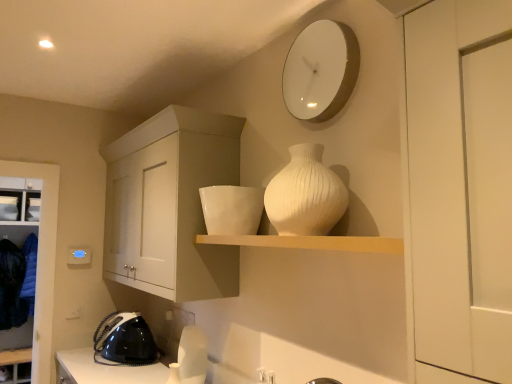
Locate an element on the screen. This screenshot has height=384, width=512. dark blue fabric at lower left is located at coordinates (13, 286).

What is the approximate height of dark blue fabric at lower left?

dark blue fabric at lower left is 91.99 centimeters tall.

What do you see at coordinates (305, 194) in the screenshot? I see `white ribbed vase at center` at bounding box center [305, 194].

Measure the distance between point (132, 320) and camera.

2.54 meters.

Where is `black plastic iron at lower left, which ranks as the second appliance in front-to-back order`? The width and height of the screenshot is (512, 384). black plastic iron at lower left, which ranks as the second appliance in front-to-back order is located at coordinates (125, 340).

Image resolution: width=512 pixels, height=384 pixels. Find the location of `metallic silver iron at left, marked as the 1th appliance in a back-to-front arrangement`. metallic silver iron at left, marked as the 1th appliance in a back-to-front arrangement is located at coordinates (9, 208).

Locate an element on the screen. white matte shelf at upper center is located at coordinates (310, 242).

From a real-world perspective, between white glossy bowl at upper center, which ranks as the 1th appliance in front-to-back order, and white glossy clock at upper center, who is vertically higher?

white glossy clock at upper center.

From the image's perspective, which is above, white glossy bowl at upper center, the 1th appliance from the top, or white glossy clock at upper center?

white glossy clock at upper center.

Can you confirm if white glossy bowl at upper center, which ranks as the 1th appliance in front-to-back order, is taller than white glossy clock at upper center?

In fact, white glossy bowl at upper center, which ranks as the 1th appliance in front-to-back order, may be shorter than white glossy clock at upper center.

Between white glossy bowl at upper center, acting as the third appliance starting from the back, and white glossy clock at upper center, which one has smaller width?

white glossy clock at upper center is thinner.

Considering the positions of objects black plastic iron at lower left, arranged as the second appliance when viewed from the left, and white matte cabinet at left, the second cabinetry in the front-to-back sequence, in the image provided, who is more to the left, black plastic iron at lower left, arranged as the second appliance when viewed from the left, or white matte cabinet at left, the second cabinetry in the front-to-back sequence,?

From the viewer's perspective, white matte cabinet at left, the second cabinetry in the front-to-back sequence, appears more on the left side.

Relative to white matte cabinet at left, arranged as the first cabinetry when viewed from the back, is black plastic iron at lower left, marked as the third appliance in a top-to-bottom arrangement, in front or behind?

Clearly, black plastic iron at lower left, marked as the third appliance in a top-to-bottom arrangement, is in front of white matte cabinet at left, arranged as the first cabinetry when viewed from the back.

Find the location of a particular element. This screenshot has width=512, height=384. appliance that appears below the white matte cabinet at left, which is counted as the 2th cabinetry, starting from the right (from a real-world perspective) is located at coordinates [x=125, y=340].

Is black plastic iron at lower left, acting as the 2th appliance starting from the right, oriented away from white matte shelf at upper center?

No, black plastic iron at lower left, acting as the 2th appliance starting from the right, is not facing away from white matte shelf at upper center.

Is black plastic iron at lower left, acting as the first appliance starting from the bottom, completely or partially outside of white matte shelf at upper center?

Yes, black plastic iron at lower left, acting as the first appliance starting from the bottom, is outside of white matte shelf at upper center.

In the image, is black plastic iron at lower left, acting as the first appliance starting from the bottom, positioned in front of or behind white matte shelf at upper center?

black plastic iron at lower left, acting as the first appliance starting from the bottom, is behind white matte shelf at upper center.

Considering the sizes of black plastic iron at lower left, acting as the first appliance starting from the bottom, and white matte shelf at upper center in the image, is black plastic iron at lower left, acting as the first appliance starting from the bottom, wider or thinner than white matte shelf at upper center?

black plastic iron at lower left, acting as the first appliance starting from the bottom, is wider than white matte shelf at upper center.

I want to click on shelf in front of the metallic silver iron at left, which is counted as the first appliance, starting from the left, so click(310, 242).

Considering the sizes of white matte shelf at upper center and metallic silver iron at left, which appears as the 2th appliance when viewed from the top, in the image, is white matte shelf at upper center wider or thinner than metallic silver iron at left, which appears as the 2th appliance when viewed from the top,?

white matte shelf at upper center is wider than metallic silver iron at left, which appears as the 2th appliance when viewed from the top.

From a real-world perspective, between white matte shelf at upper center and metallic silver iron at left, marked as the 1th appliance in a back-to-front arrangement, who is vertically lower?

From a 3D spatial view, white matte shelf at upper center is below.

Between point (203, 243) and point (12, 214), which one is positioned in front?

Positioned in front is point (203, 243).

Considering the sizes of objects white matte cabinet at left, arranged as the first cabinetry when viewed from the back, and black plastic iron at lower left, which ranks as the second appliance in front-to-back order, in the image provided, who is shorter, white matte cabinet at left, arranged as the first cabinetry when viewed from the back, or black plastic iron at lower left, which ranks as the second appliance in front-to-back order,?

Standing shorter between the two is black plastic iron at lower left, which ranks as the second appliance in front-to-back order.

From the image's perspective, count 1st appliances upward from the white matte cabinet at left, which is counted as the 1th cabinetry, starting from the left, and point to it. Please provide its 2D coordinates.

[(125, 340)]

Could you tell me if white matte cabinet at left, which is counted as the 2th cabinetry, starting from the right, is turned towards black plastic iron at lower left, arranged as the second appliance when viewed from the left?

No, white matte cabinet at left, which is counted as the 2th cabinetry, starting from the right, is not turned towards black plastic iron at lower left, arranged as the second appliance when viewed from the left.

Is white matte cabinet at left, arranged as the first cabinetry when viewed from the back, next to black plastic iron at lower left, arranged as the second appliance when viewed from the left?

No, white matte cabinet at left, arranged as the first cabinetry when viewed from the back, is not with black plastic iron at lower left, arranged as the second appliance when viewed from the left.

Based on the photo, is there a large distance between white glossy clock at upper center and white ribbed vase at center?

They are positioned close to each other.

Is white glossy clock at upper center outside of white ribbed vase at center?

Yes, white glossy clock at upper center is not within white ribbed vase at center.

From the image's perspective, is white glossy clock at upper center above or below white ribbed vase at center?

white glossy clock at upper center is situated higher than white ribbed vase at center in the image.

From a real-world perspective, is white matte cabinet at upper left, which is the 1th cabinetry from right to left, physically above white glossy bowl at upper center, the 1th appliance from the top?

Yes.

Are white matte cabinet at upper left, arranged as the second cabinetry when viewed from the back, and white glossy bowl at upper center, acting as the third appliance starting from the back, making contact?

No, white matte cabinet at upper left, arranged as the second cabinetry when viewed from the back, is not beside white glossy bowl at upper center, acting as the third appliance starting from the back.

At what (x,y) coordinates should I click in order to perform the action: click on appliance lying on the right of white matte cabinet at upper left, positioned as the first cabinetry in front-to-back order. Please return your answer as a coordinate pair (x, y). This screenshot has height=384, width=512. Looking at the image, I should click on (232, 209).

Where is `clock positioned vertically above the white glossy bowl at upper center, acting as the third appliance starting from the back (from a real-world perspective)`? clock positioned vertically above the white glossy bowl at upper center, acting as the third appliance starting from the back (from a real-world perspective) is located at coordinates (320, 71).

The image size is (512, 384). In order to click on cabinetry behind the black plastic iron at lower left, which is counted as the second appliance, starting from the back in this screenshot , I will do `click(42, 261)`.

Looking at the image, which one is located further to metallic silver iron at left, marked as the 1th appliance in a back-to-front arrangement, white glossy bowl at upper center, the 3th appliance in the bottom-to-top sequence, or white matte cabinet at upper left, positioned as the first cabinetry in front-to-back order?

Among the two, white glossy bowl at upper center, the 3th appliance in the bottom-to-top sequence, is located further to metallic silver iron at left, marked as the 1th appliance in a back-to-front arrangement.

Which object lies nearer to the anchor point dark blue fabric at lower left, white glossy clock at upper center or white ribbed vase at center?

white ribbed vase at center is closer to dark blue fabric at lower left.

From the image, which object appears to be nearer to white matte cabinet at left, which is counted as the 1th cabinetry, starting from the left, white glossy bowl at upper center, which ranks as the 1th appliance in front-to-back order, or white matte shelf at upper center?

Among the two, white glossy bowl at upper center, which ranks as the 1th appliance in front-to-back order, is located nearer to white matte cabinet at left, which is counted as the 1th cabinetry, starting from the left.

Which object lies further to the anchor point white glossy clock at upper center, white matte cabinet at left, arranged as the first cabinetry when viewed from the back, or white matte cabinet at upper left, positioned as the first cabinetry in front-to-back order?

Among the two, white matte cabinet at left, arranged as the first cabinetry when viewed from the back, is located further to white glossy clock at upper center.

When comparing their distances from black plastic iron at lower left, which is counted as the second appliance, starting from the back, does white matte cabinet at upper left, which is counted as the 2th cabinetry, starting from the left, or white glossy bowl at upper center, which is the 3th appliance in left-to-right order, seem closer?

Among the two, white matte cabinet at upper left, which is counted as the 2th cabinetry, starting from the left, is located nearer to black plastic iron at lower left, which is counted as the second appliance, starting from the back.

Looking at the image, which one is located further to white glossy clock at upper center, metallic silver iron at left, which appears as the 2th appliance when viewed from the top, or dark blue fabric at lower left?

The object further to white glossy clock at upper center is dark blue fabric at lower left.

From the image, which object appears to be nearer to white matte shelf at upper center, dark blue fabric at lower left or black plastic iron at lower left, acting as the first appliance starting from the bottom?

black plastic iron at lower left, acting as the first appliance starting from the bottom, lies closer to white matte shelf at upper center than the other object.

Which object lies further to the anchor point white matte shelf at upper center, white matte cabinet at left, which is counted as the 2th cabinetry, starting from the right, or black plastic iron at lower left, marked as the third appliance in a top-to-bottom arrangement?

Among the two, white matte cabinet at left, which is counted as the 2th cabinetry, starting from the right, is located further to white matte shelf at upper center.

Locate an element on the screen. The image size is (512, 384). appliance between white glossy bowl at upper center, the 3th appliance in the bottom-to-top sequence, and metallic silver iron at left, arranged as the 2th appliance when ordered from the bottom, along the z-axis is located at coordinates (125, 340).

Where is `vase situated between white matte cabinet at upper left, which is counted as the 2th cabinetry, starting from the left, and white glossy clock at upper center from left to right`? The image size is (512, 384). vase situated between white matte cabinet at upper left, which is counted as the 2th cabinetry, starting from the left, and white glossy clock at upper center from left to right is located at coordinates (305, 194).

The height and width of the screenshot is (384, 512). In order to click on vase between dark blue fabric at lower left and white glossy clock at upper center in this screenshot , I will do `click(305, 194)`.

Identify the location of shelf located between white matte cabinet at upper left, which is the 1th cabinetry from right to left, and white glossy clock at upper center in the left-right direction. (310, 242).